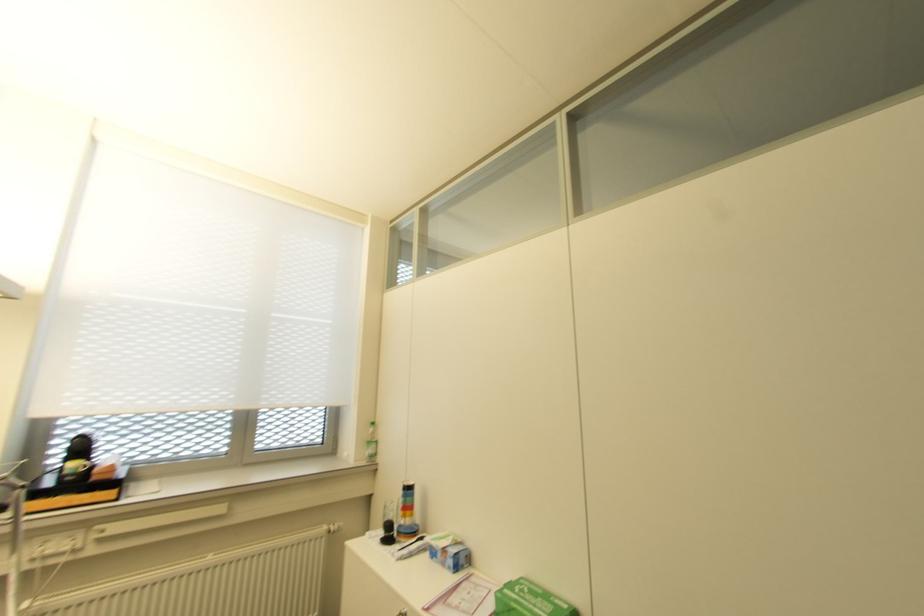
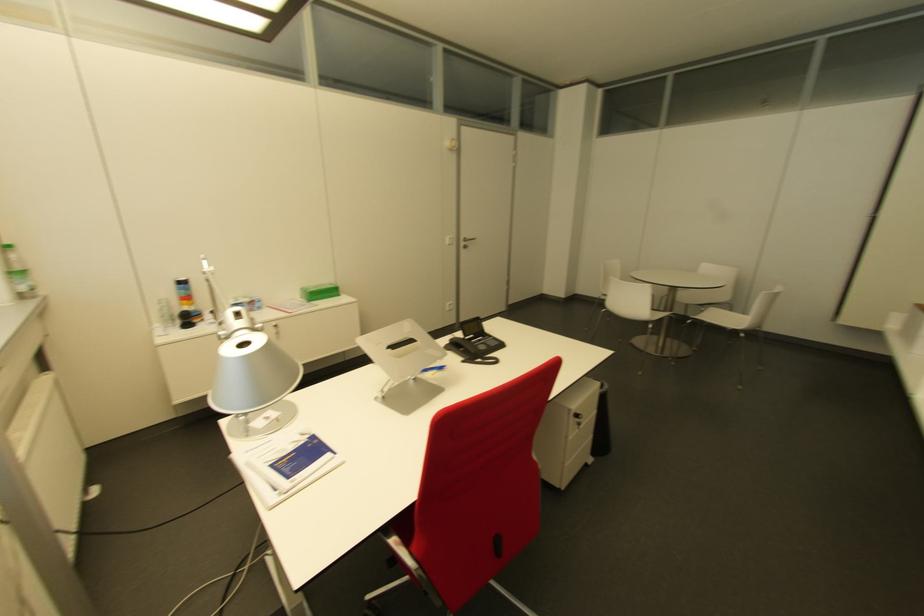
Where in the second image is the point corresponding to [369,451] from the first image?

(27, 284)